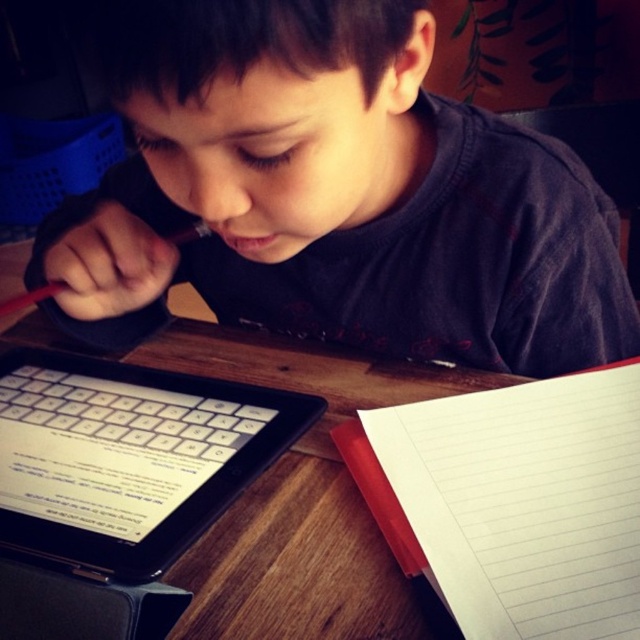
You are a student who needs to place a small sticker on the white lined paper at lower right. Can you reach it without moving the wooden table at center?

The white lined paper at lower right is closer to the viewer than the wooden table at center, so yes, you can reach it without moving the wooden table at center because it is positioned nearer to you.

The boy is trying to place a new sheet of paper between the white lined paper at lower right and the black plastic tablet at lower left. Considering their heights, will the new sheet fit vertically between them?

The white lined paper at lower right is much taller than the black plastic tablet at lower left, so the new sheet might not fit vertically between them because the height difference could leave a gap too small for the sheet to fit.